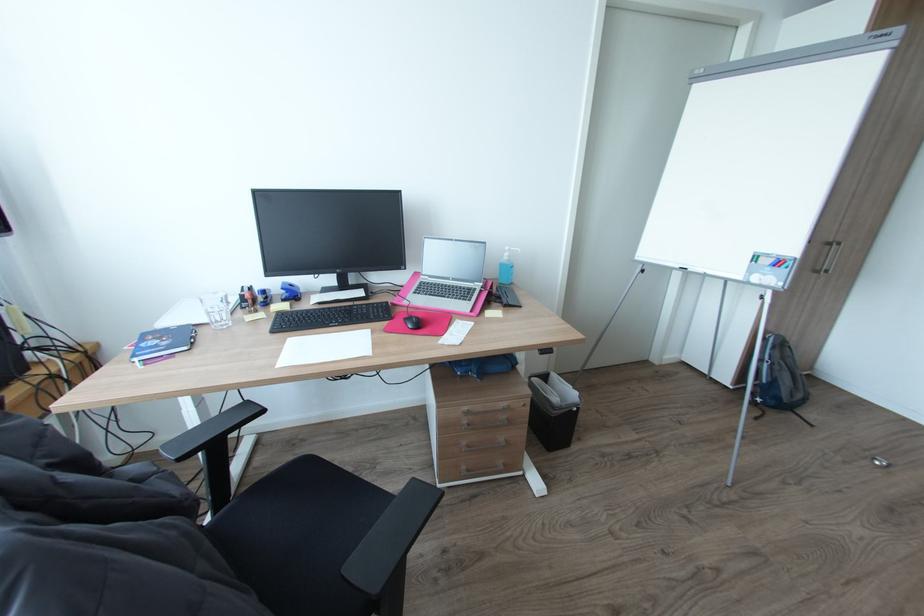
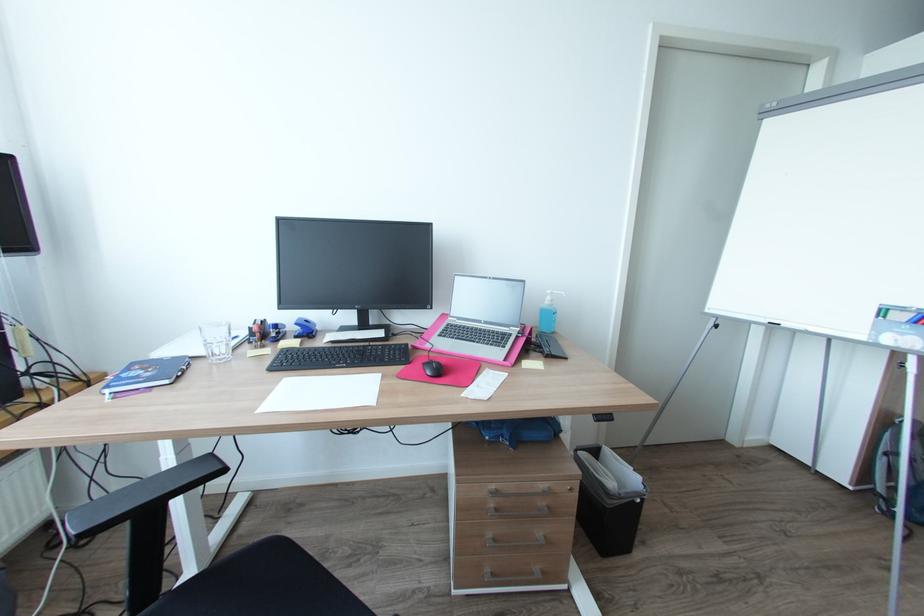
Where in the second image is the point corresponding to [418,322] from the first image?

(438, 368)